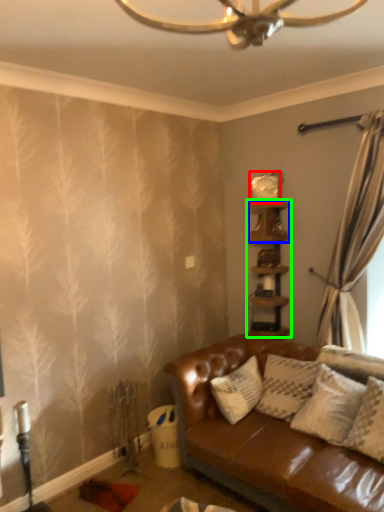
Question: Considering the real-world distances, which object is closest to clock (highlighted by a red box)? shelf (highlighted by a blue box) or shelf (highlighted by a green box).

Choices:
 (A) shelf
 (B) shelf

Answer: (A)